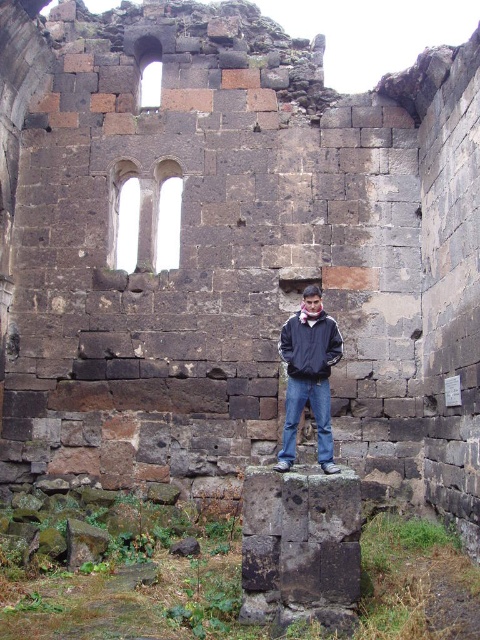
Is dark blue jacket at center shorter than dark blue fabric jacket at center?

Incorrect, dark blue jacket at center's height does not fall short of dark blue fabric jacket at center's.

In the scene shown: Which is above, dark blue jacket at center or dark blue fabric jacket at center?

dark blue fabric jacket at center is above.

Identify the location of dark blue jacket at center. (309, 376).